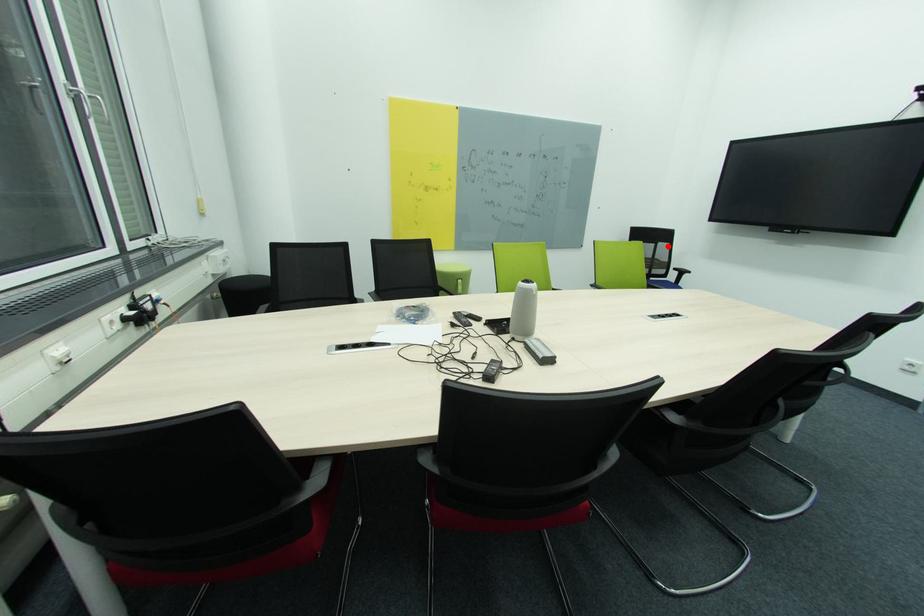
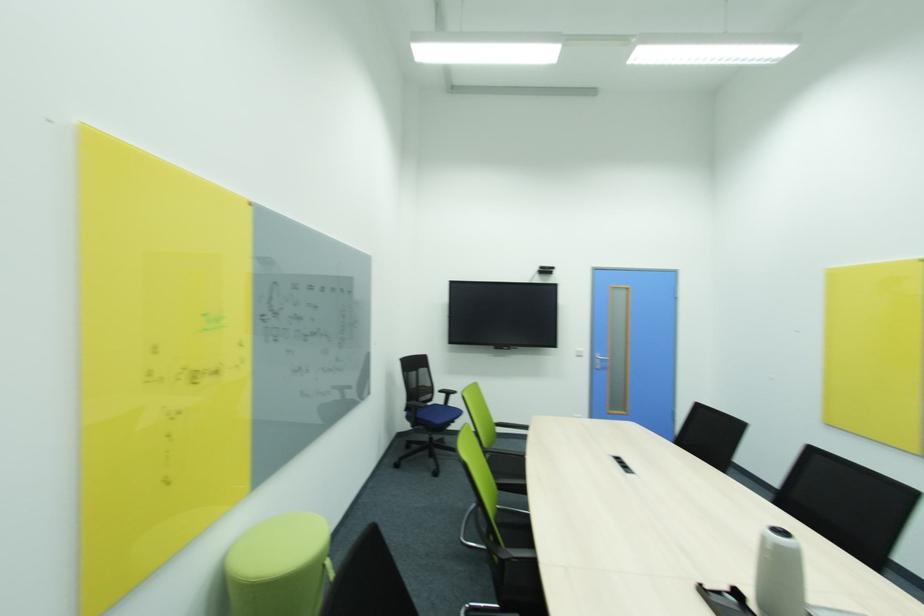
In the second image, find the point that corresponds to the highlighted location in the first image.

(428, 371)